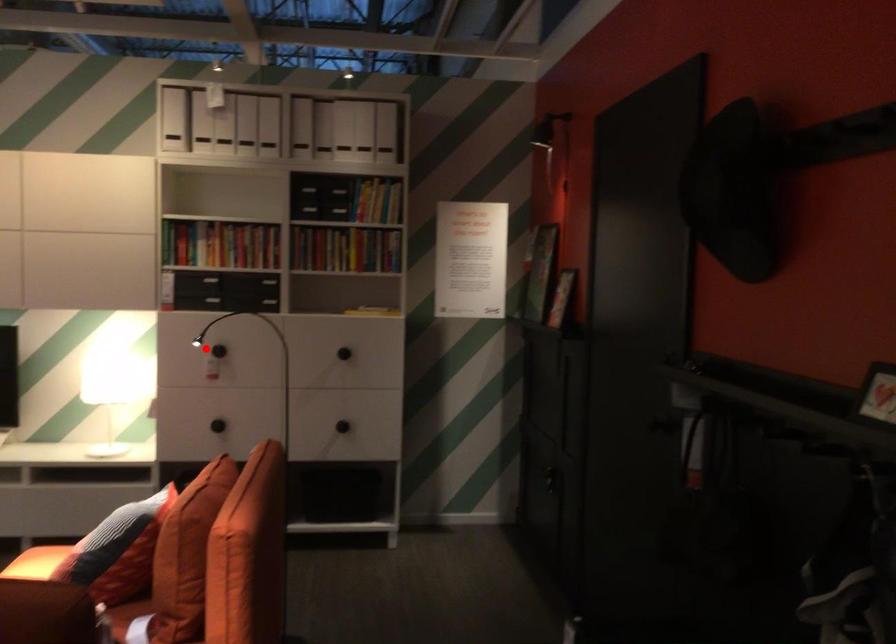
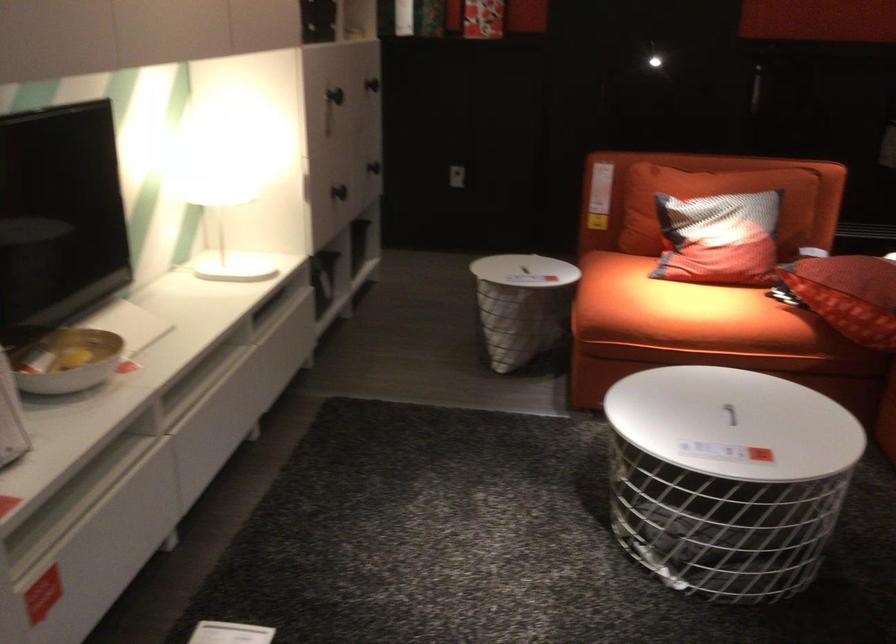
Where in the second image is the point corresponding to the highlighted location from the first image?

(334, 95)